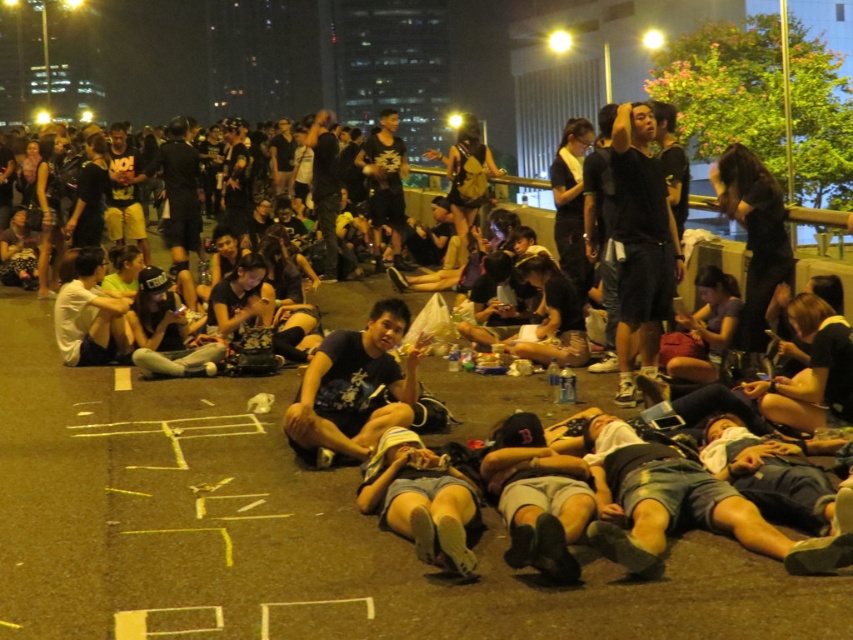
You are standing in the nighttime scene described. If you want to walk to the dark asphalt pavement at center, what coordinates should you head towards?

You should head towards the coordinates point (288, 531) to reach the dark asphalt pavement at center.